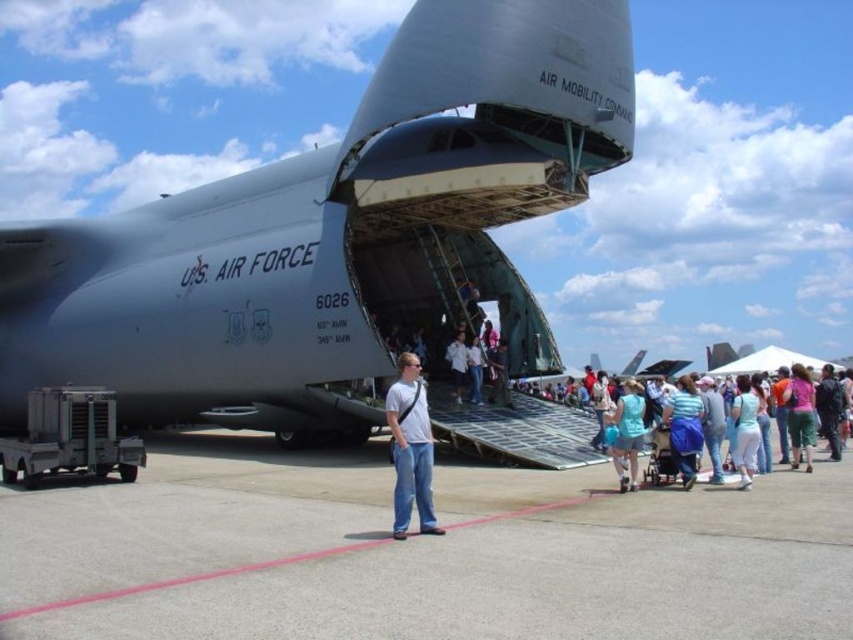
Question: Can you confirm if matte gray airplane at center is positioned to the right of light blue denim jeans at lower right?

Choices:
 (A) yes
 (B) no

Answer: (B)

Question: Does blue fabric bag at lower right appear under light blue fabric dress at center?

Choices:
 (A) yes
 (B) no

Answer: (B)

Question: Which of the following is the closest to the observer?

Choices:
 (A) (450, 348)
 (B) (413, 412)

Answer: (B)

Question: Which point is farther from the camera taking this photo?

Choices:
 (A) (329, 458)
 (B) (640, 445)
 (C) (436, 19)
 (D) (654, 472)

Answer: (A)

Question: Considering the relative positions of gray asphalt tarmac at center and white cotton shirt at center in the image provided, where is gray asphalt tarmac at center located with respect to white cotton shirt at center?

Choices:
 (A) right
 (B) left

Answer: (B)

Question: Which point is closer to the camera?

Choices:
 (A) matte gray airplane at center
 (B) white cotton shirt at center
 (C) light blue denim jeans at lower right
 (D) white matte t-shirt at center

Answer: (D)